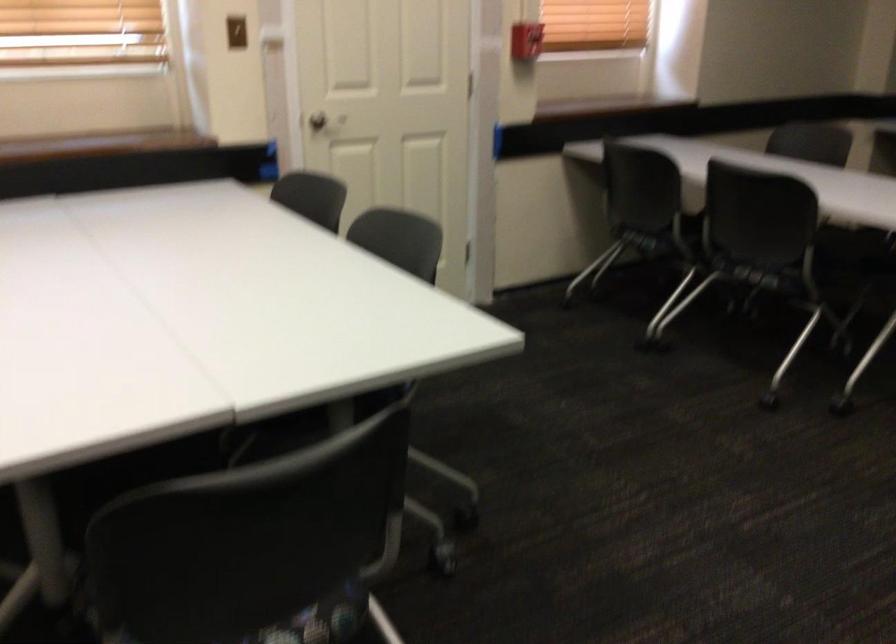
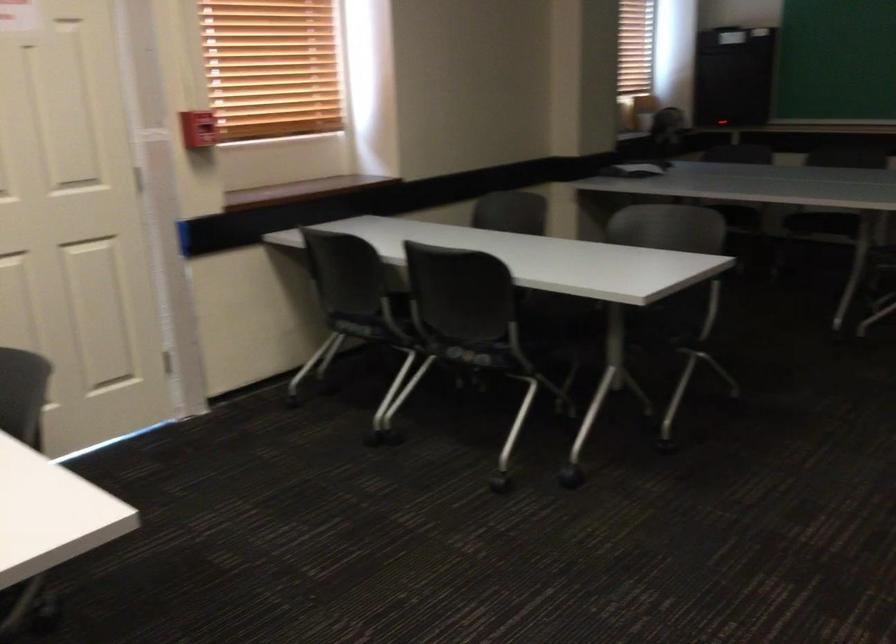
Question: The camera is either moving clockwise (left) or counter-clockwise (right) around the object. The first image is from the beginning of the video and the second image is from the end. Is the camera moving left or right when shooting the video?

Choices:
 (A) Left
 (B) Right

Answer: (A)